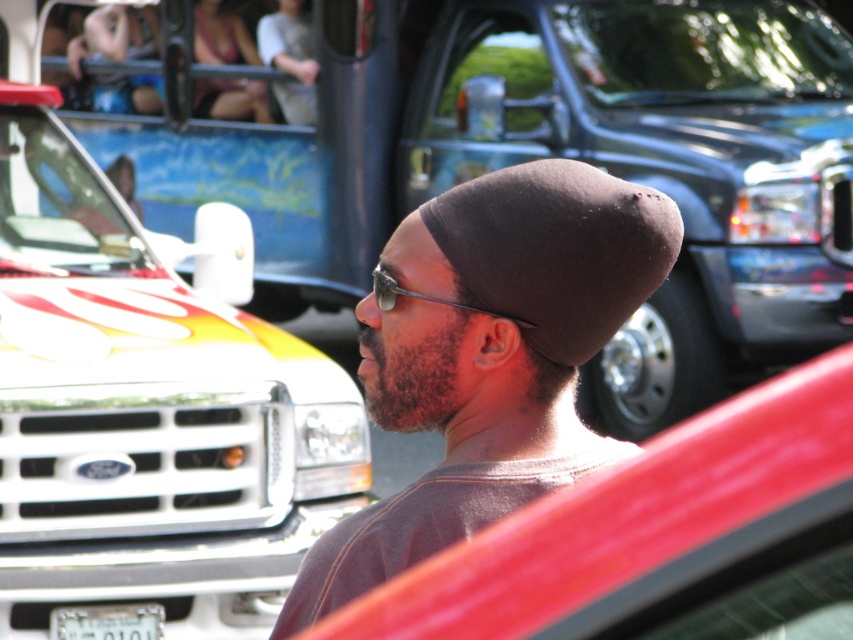
Who is taller, white glossy pickup truck at center or black matte baseball cap at center?

Standing taller between the two is white glossy pickup truck at center.

Which is in front, point (714, 339) or point (633, 268)?

Point (633, 268) is in front.

Where is `white glossy pickup truck at center`? Image resolution: width=853 pixels, height=640 pixels. white glossy pickup truck at center is located at coordinates (492, 148).

Is point (320, 291) farther from viewer compared to point (518, 589)?

Yes, it is.

Is white glossy pickup truck at center smaller than matte black car at center?

No.

You are a GUI agent. You are given a task and a screenshot of the screen. Output one action in this format:
    pyautogui.click(x=<x>, y=<y>)
    Task: Click on the white glossy pickup truck at center
    This screenshot has height=640, width=853.
    Given the screenshot: What is the action you would take?
    pyautogui.click(x=492, y=148)

Is point (479, 284) behind point (102, 627)?

No, it is not.

Is black matte baseball cap at center shorter than white plastic license plate at lower center?

In fact, black matte baseball cap at center may be taller than white plastic license plate at lower center.

You are a GUI agent. You are given a task and a screenshot of the screen. Output one action in this format:
    pyautogui.click(x=<x>, y=<y>)
    Task: Click on the black matte baseball cap at center
    
    Given the screenshot: What is the action you would take?
    [x=556, y=250]

Locate an element on the screen. The image size is (853, 640). black matte baseball cap at center is located at coordinates [556, 250].